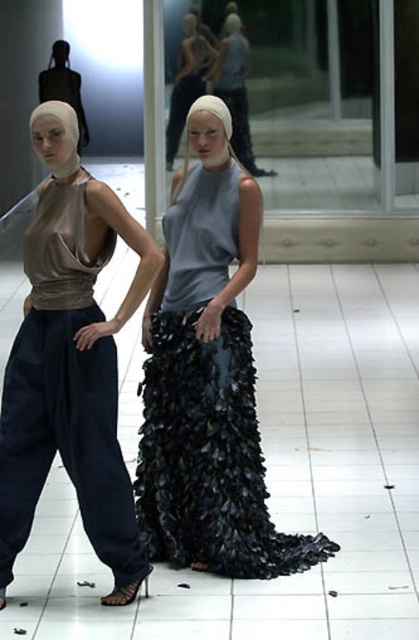
Does point (147, 349) lie behind point (207, 29)?

No, (147, 349) is in front of (207, 29).

Who is shorter, shiny black fabric dress at center or matte gray dress at center?

matte gray dress at center

Which is in front, point (150, 552) or point (196, 32)?

Positioned in front is point (150, 552).

The image size is (419, 640). I want to click on shiny black fabric dress at center, so click(x=209, y=378).

Which of these two, matte brown fabric top at left or matte gray dress at center, stands shorter?

Standing shorter between the two is matte gray dress at center.

Locate an element on the screen. matte brown fabric top at left is located at coordinates (70, 360).

You are a GUI agent. You are given a task and a screenshot of the screen. Output one action in this format:
    pyautogui.click(x=<x>, y=<y>)
    Task: Click on the matte brown fabric top at left
    The height and width of the screenshot is (640, 419).
    Given the screenshot: What is the action you would take?
    pyautogui.click(x=70, y=360)

Who is positioned more to the right, shiny black fabric dress at center or matte brown fabric top at left?

From the viewer's perspective, shiny black fabric dress at center appears more on the right side.

Is shiny black fabric dress at center below matte brown fabric top at left?

→ No, shiny black fabric dress at center is not below matte brown fabric top at left.

Between point (220, 104) and point (75, 467), which one is positioned behind?

The point (220, 104) is more distant.

At what (x,y) coordinates should I click in order to perform the action: click on shiny black fabric dress at center. Please return your answer as a coordinate pair (x, y). The width and height of the screenshot is (419, 640). Looking at the image, I should click on (209, 378).